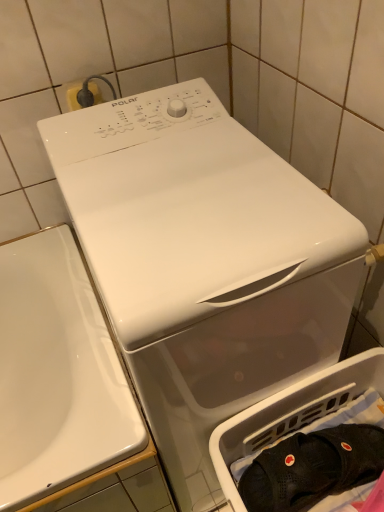
Question: Is point (145, 352) closer or farther from the camera than point (231, 458)?

Choices:
 (A) closer
 (B) farther

Answer: (A)

Question: In the image, is white glossy washing machine at center positioned in front of or behind black mesh bag at lower right?

Choices:
 (A) front
 (B) behind

Answer: (A)

Question: Which is nearer to the black mesh socks at lower right?

Choices:
 (A) white glossy washing machine at center
 (B) black mesh bag at lower right

Answer: (B)

Question: Which of these objects is positioned farthest from the black mesh bag at lower right?

Choices:
 (A) black mesh socks at lower right
 (B) white glossy washing machine at center

Answer: (B)